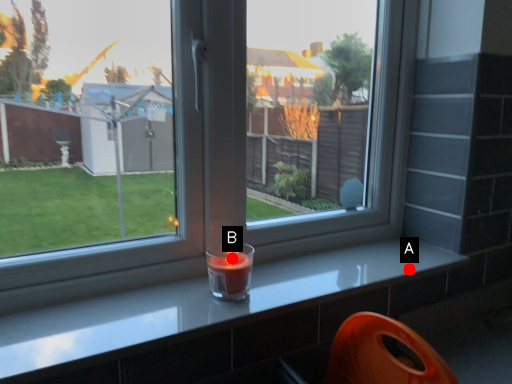
Question: Two points are circled on the image, labeled by A and B beside each circle. Which point is further to the camera?

Choices:
 (A) A is further
 (B) B is further

Answer: (A)